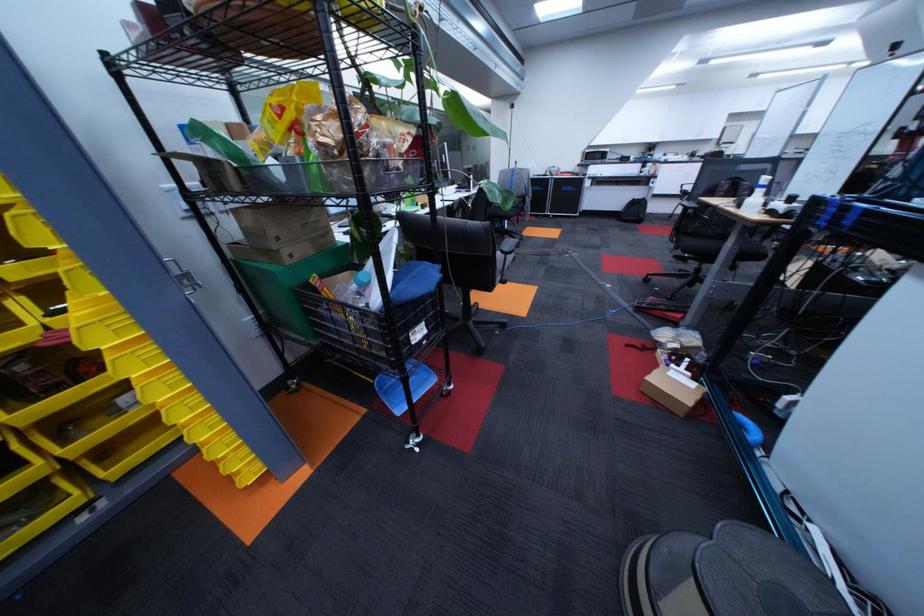
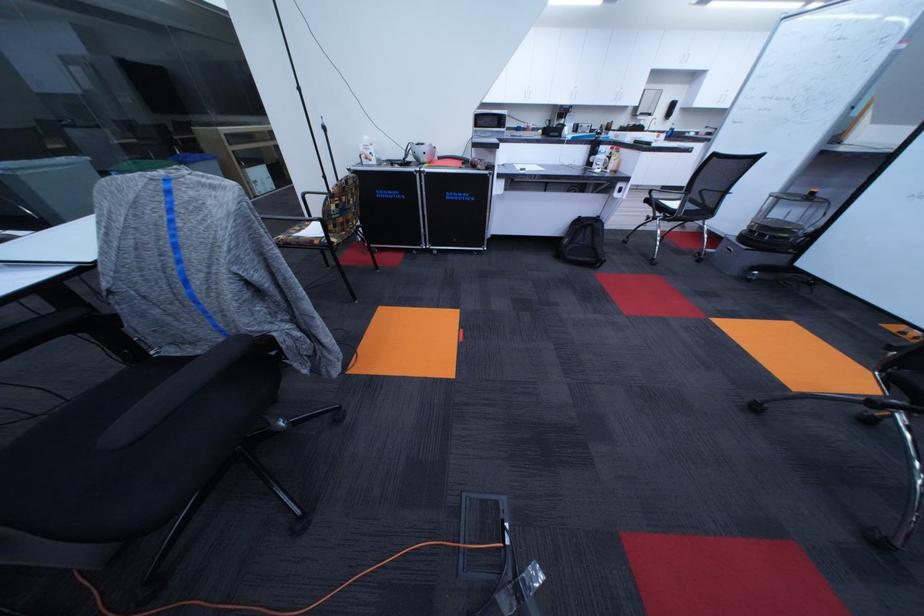
Locate, in the second image, the point that corresponds to [622,158] in the first image.

(521, 124)